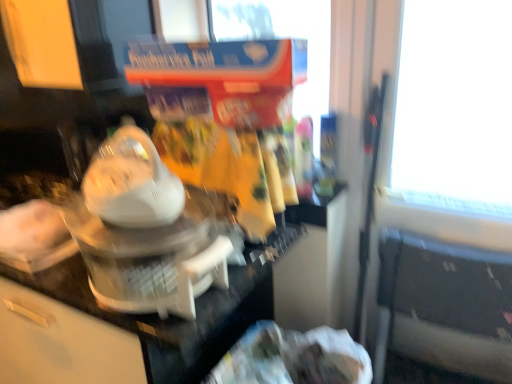
Question: From the image's perspective, does black plastic chair at lower right appear higher than white plastic blender at center?

Choices:
 (A) no
 (B) yes

Answer: (A)

Question: Is black plastic chair at lower right at the left side of white plastic blender at center?

Choices:
 (A) no
 (B) yes

Answer: (A)

Question: Is black plastic chair at lower right bigger than white plastic blender at center?

Choices:
 (A) no
 (B) yes

Answer: (B)

Question: Is black plastic chair at lower right oriented towards white plastic blender at center?

Choices:
 (A) no
 (B) yes

Answer: (A)

Question: Is black plastic chair at lower right located outside white plastic blender at center?

Choices:
 (A) yes
 (B) no

Answer: (A)

Question: Considering the positions of point (413, 349) and point (209, 319), is point (413, 349) closer or farther from the camera than point (209, 319)?

Choices:
 (A) farther
 (B) closer

Answer: (A)

Question: Is black plastic chair at lower right in front of or behind white glossy counter top at center in the image?

Choices:
 (A) front
 (B) behind

Answer: (B)

Question: Visually, is black plastic chair at lower right positioned to the left or to the right of white glossy counter top at center?

Choices:
 (A) right
 (B) left

Answer: (A)

Question: Considering the positions of black plastic chair at lower right and white glossy counter top at center in the image, is black plastic chair at lower right taller or shorter than white glossy counter top at center?

Choices:
 (A) tall
 (B) short

Answer: (B)

Question: From the image's perspective, is white glossy counter top at center above or below white plastic blender at center?

Choices:
 (A) above
 (B) below

Answer: (B)

Question: Is white glossy counter top at center bigger or smaller than white plastic blender at center?

Choices:
 (A) big
 (B) small

Answer: (A)

Question: In the image, is white glossy counter top at center positioned in front of or behind white plastic blender at center?

Choices:
 (A) behind
 (B) front

Answer: (A)

Question: In terms of height, does white glossy counter top at center look taller or shorter compared to white plastic blender at center?

Choices:
 (A) tall
 (B) short

Answer: (A)

Question: Is white plastic blender at center situated inside black plastic chair at lower right or outside?

Choices:
 (A) inside
 (B) outside

Answer: (B)

Question: Considering their positions, is white plastic blender at center located in front of or behind black plastic chair at lower right?

Choices:
 (A) front
 (B) behind

Answer: (A)